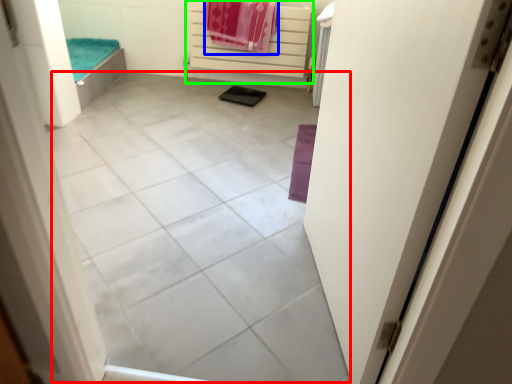
Question: Based on their relative distances, which object is nearer to tile (highlighted by a red box)? Choose from beach towel (highlighted by a blue box) and balustrade (highlighted by a green box).

Choices:
 (A) beach towel
 (B) balustrade

Answer: (A)